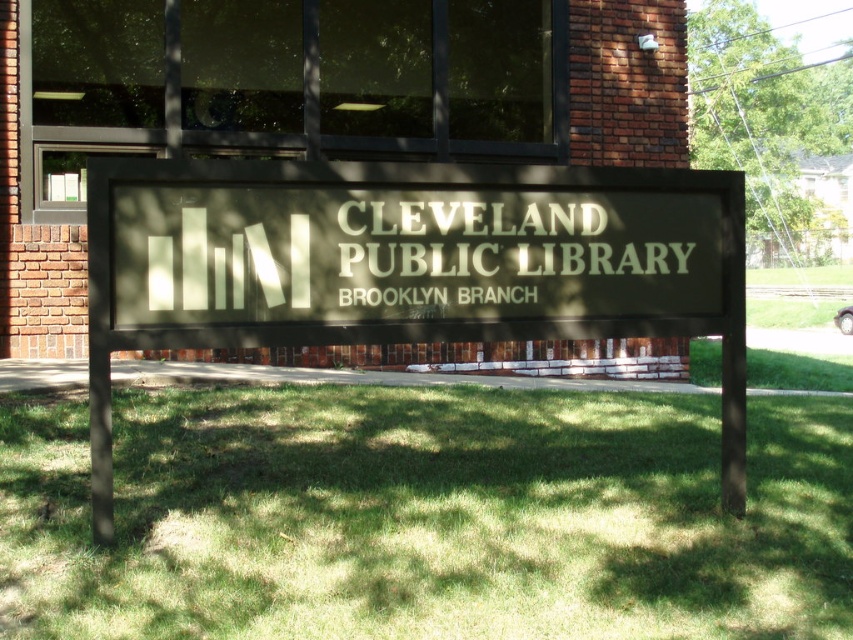
Question: Among these points, which one is farthest from the camera?

Choices:
 (A) (817, 568)
 (B) (422, 259)

Answer: (A)

Question: Which of the following is the farthest from the observer?

Choices:
 (A) matte black sign at center
 (B) green grass at center

Answer: (A)

Question: Does green grass at center appear on the left side of matte black sign at center?

Choices:
 (A) yes
 (B) no

Answer: (B)

Question: In this image, where is green grass at center located relative to matte black sign at center?

Choices:
 (A) left
 (B) right

Answer: (B)

Question: Does green grass at center appear on the left side of matte black sign at center?

Choices:
 (A) no
 (B) yes

Answer: (A)